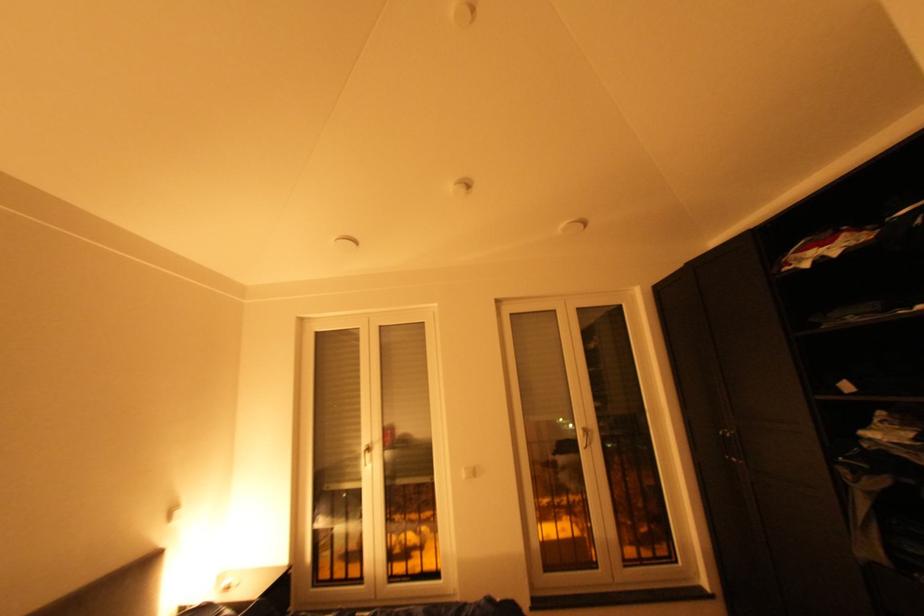
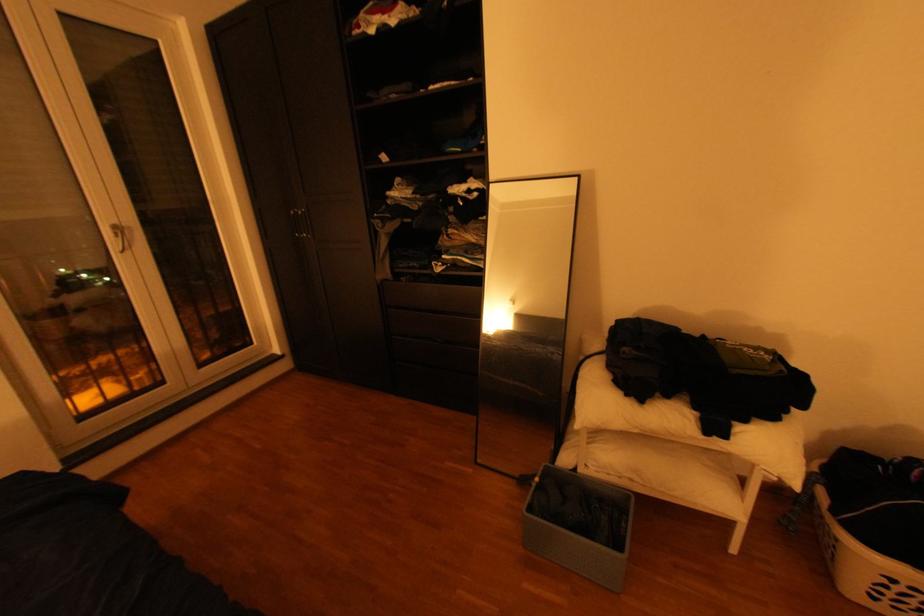
Based on the continuous images, in which direction is the camera rotating?

The camera's rotation is toward right-down.